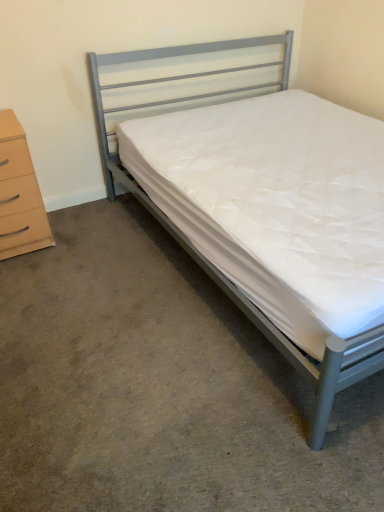
Locate an element on the screen. The width and height of the screenshot is (384, 512). free spot above white quilted mattress at center (from a real-world perspective) is located at coordinates (144, 333).